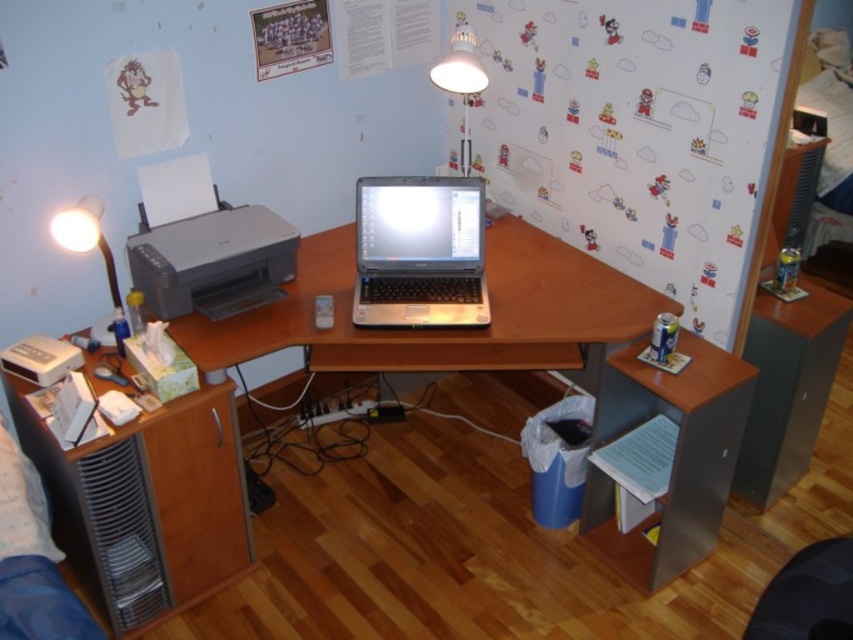
You are organizing the desk and want to place a new object between the white plastic lamp at upper left and the white glossy lamp at upper center. Is there enough vertical space to do this?

The white plastic lamp at upper left is below the white glossy lamp at upper center, so there is vertical space between them. You can place the new object between them vertically.

You are organizing the desk and want to place a tall vase between the white plastic lamp at upper left and the white glossy lamp at upper center. Based on their heights, which lamp will the vase be closer to?

The white plastic lamp at upper left has a lesser height compared to the white glossy lamp at upper center. Therefore, the vase will be closer to the taller white glossy lamp at upper center because the height difference may affect the placement to balance the visual weight.

You are a delivery person who just arrived at this home office. You need to place a package that is 6 feet long on the desk between the matte gray printer at left and the edge of the desk. Is there enough space?

The distance between the matte gray printer at left and the edge of the desk is not provided in the scene description. Therefore, it is impossible to determine if there is enough space for the 6 feet long package.